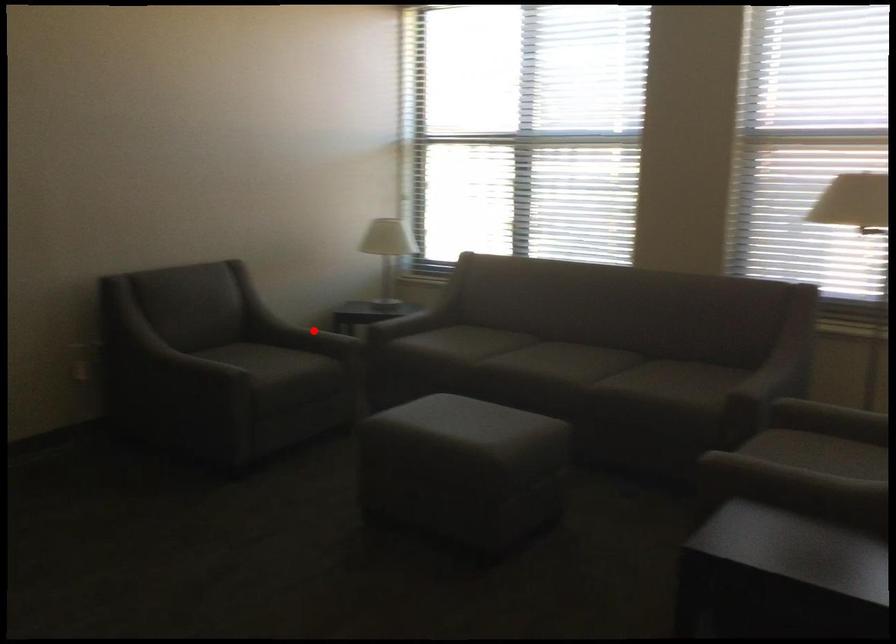
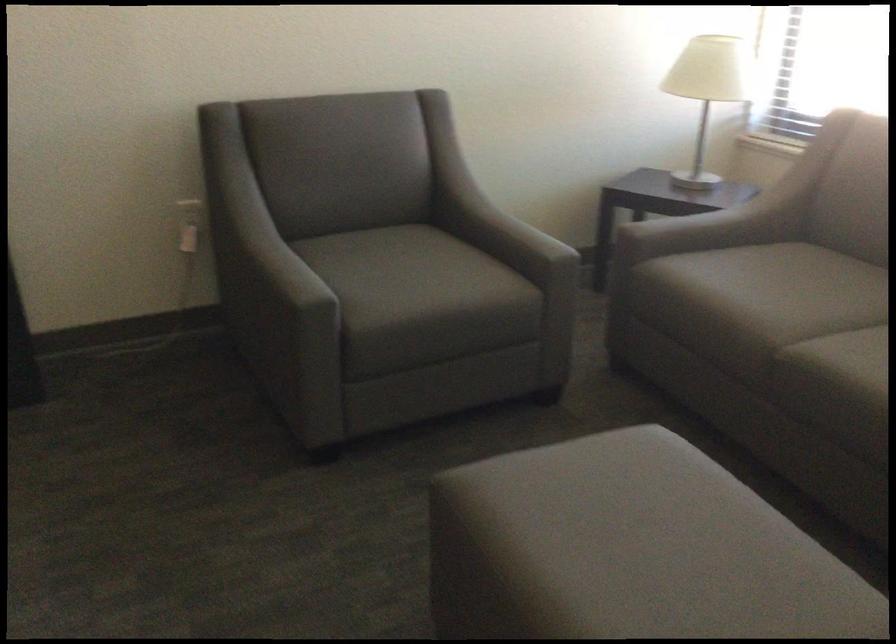
Question: I am providing you with two images of the same scene from different viewpoints. A red point is marked on the first image. Can you still see the location of the red point in image 2?

Choices:
 (A) Yes
 (B) No

Answer: (A)